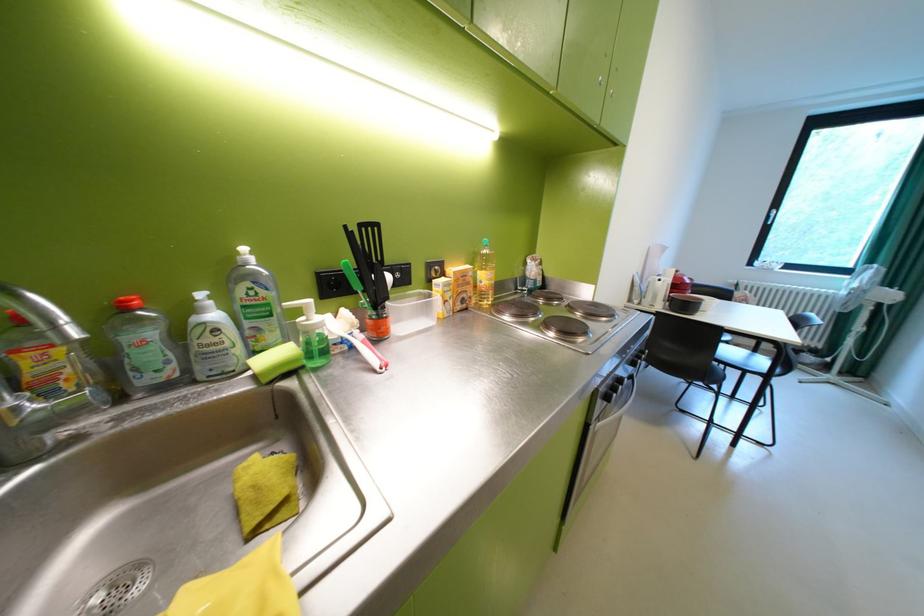
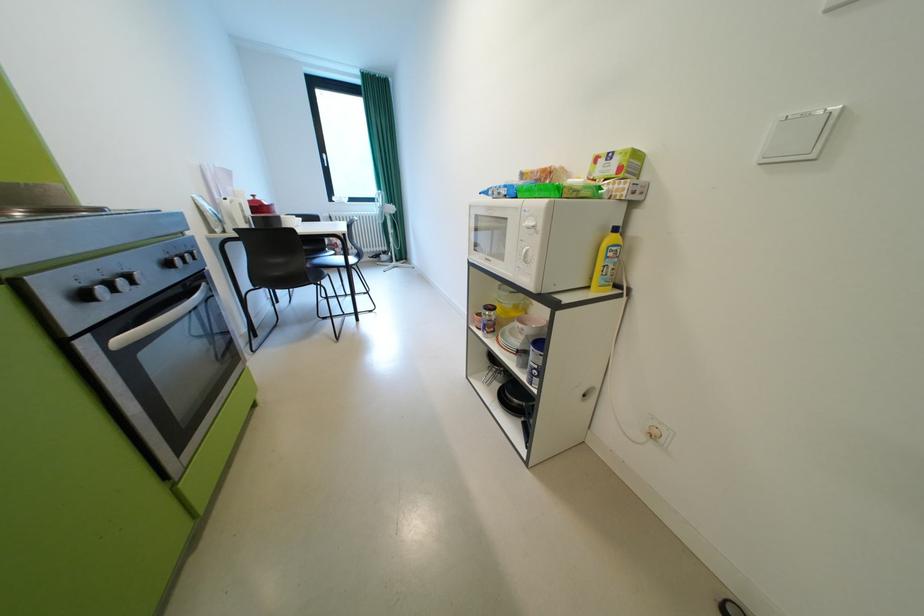
The first image is from the beginning of the video and the second image is from the end. How did the camera likely rotate when shooting the video?

The camera's rotation is toward right-down.